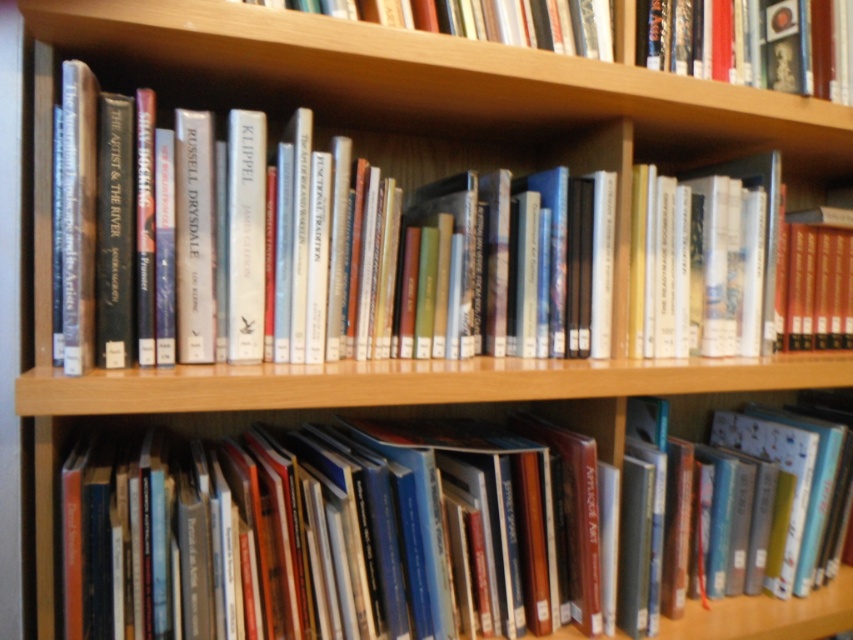
Is hardcover book at upper right smaller than hardcover books at center?

Yes.

Between hardcover book at upper right and hardcover books at center, which one has more height?

hardcover books at center

Between point (686, 51) and point (621, 224), which one is positioned in front?

Positioned in front is point (621, 224).

Locate an element on the screen. This screenshot has height=640, width=853. hardcover book at upper right is located at coordinates (755, 42).

Who is positioned more to the left, hardcover book at lower center or hardcover books at center?

hardcover books at center

Who is more distant from viewer, [753,621] or [241,362]?

The point [753,621] is more distant.

Identify the location of hardcover book at lower center. Image resolution: width=853 pixels, height=640 pixels. (767, 614).

Who is higher up, hardcover book at upper right or hardcover book at lower center?

Positioned higher is hardcover book at upper right.

Is hardcover book at upper right positioned at the back of hardcover book at lower center?

Yes, it is.

What do you see at coordinates (755, 42) in the screenshot? I see `hardcover book at upper right` at bounding box center [755, 42].

Locate an element on the screen. Image resolution: width=853 pixels, height=640 pixels. hardcover book at upper right is located at coordinates (755, 42).